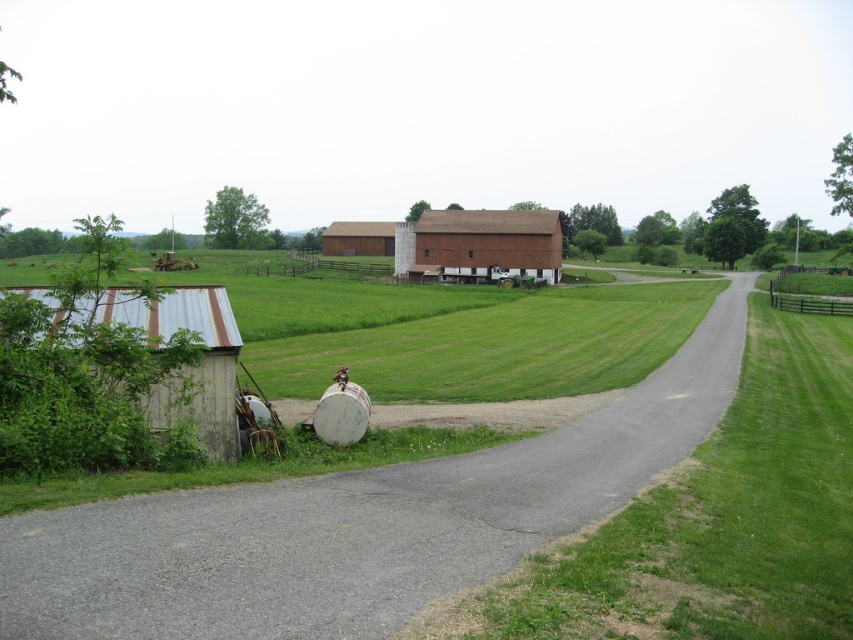
Does point (584, 506) come farther from viewer compared to point (363, 248)?

That is False.

The image size is (853, 640). What do you see at coordinates (358, 522) in the screenshot?
I see `gray asphalt road at center` at bounding box center [358, 522].

Image resolution: width=853 pixels, height=640 pixels. Identify the location of gray asphalt road at center. (358, 522).

At what (x,y) coordinates should I click in order to perform the action: click on rusty corrugated metal shed at lower left. Please return your answer as a coordinate pair (x, y). The width and height of the screenshot is (853, 640). Looking at the image, I should click on (192, 368).

Which is more to the left, rusty corrugated metal shed at lower left or brown wooden barn at center?

brown wooden barn at center

Where is `rusty corrugated metal shed at lower left`? This screenshot has width=853, height=640. rusty corrugated metal shed at lower left is located at coordinates (192, 368).

Between brown wood barn at center and brown wooden barn at center, which one has less height?

With less height is brown wood barn at center.

Does point (518, 240) come farther from viewer compared to point (345, 248)?

No.

Where is `brown wood barn at center`? The image size is (853, 640). brown wood barn at center is located at coordinates (482, 246).